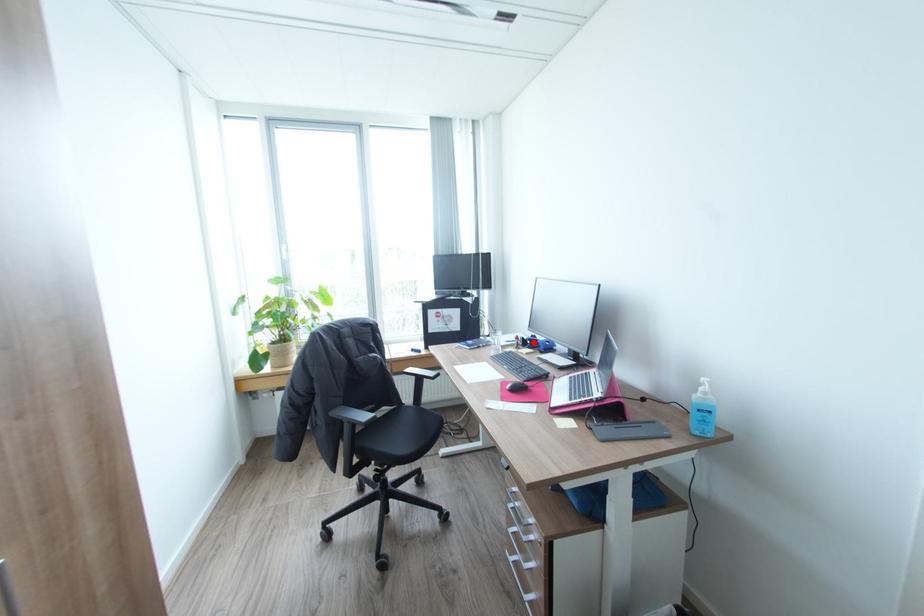
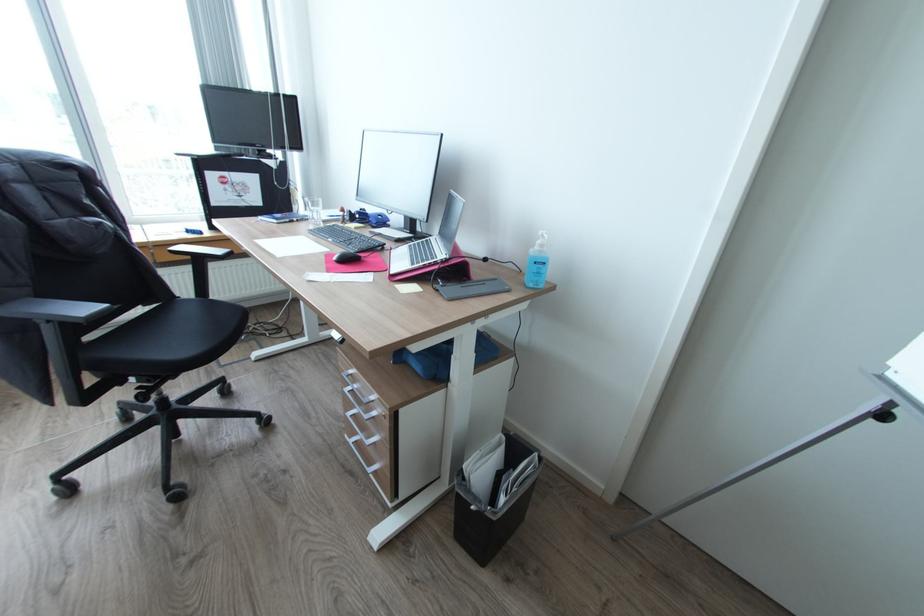
Where in the second image is the point corresponding to the highlighted location from the first image?

(362, 216)